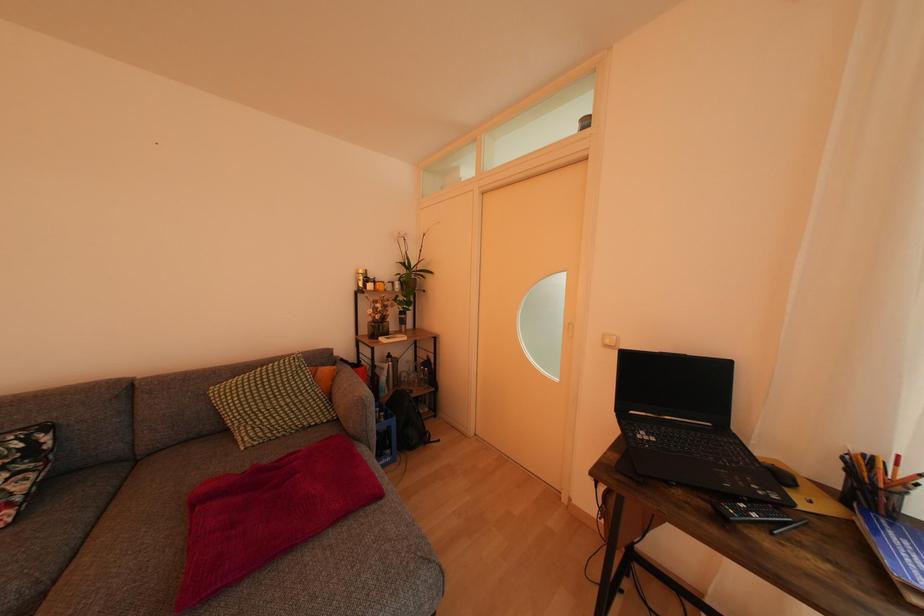
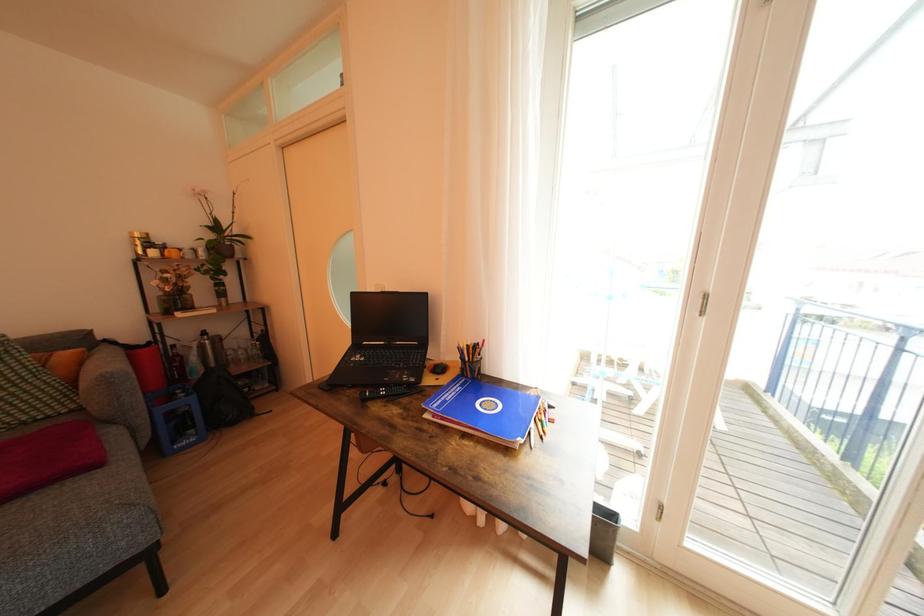
What movement of the cameraman would produce the second image?

The cameraman walked toward right, backward.